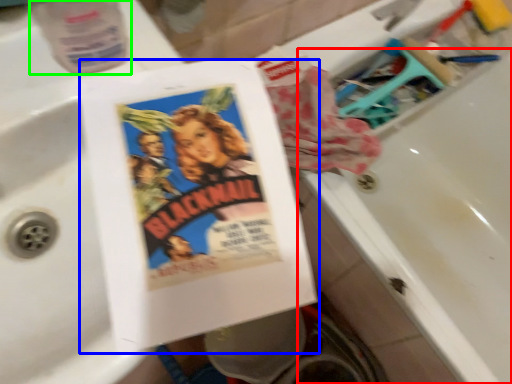
Question: Which object is the farthest from bath (highlighted by a red box)? Choose among these: paperback book (highlighted by a blue box) or bottle (highlighted by a green box).

Choices:
 (A) paperback book
 (B) bottle

Answer: (B)